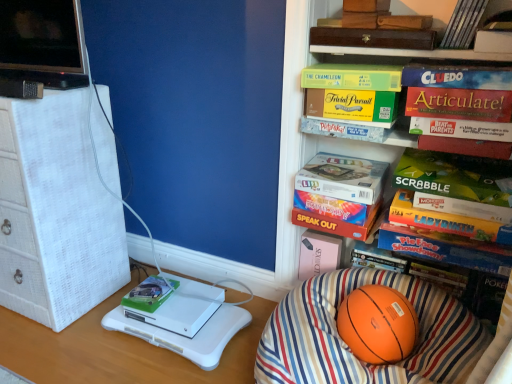
Question: Do you think hardcover book at upper right, the fourth book from the left, is within matte cardboard pictionary at upper center, which is counted as the second book, starting from the top, or outside of it?

Choices:
 (A) outside
 (B) inside

Answer: (A)

Question: Considering the positions of hardcover book at upper right, which is the fourth book from bottom to top, and matte cardboard pictionary at upper center, which is the third book in bottom-to-top order, in the image, is hardcover book at upper right, which is the fourth book from bottom to top, bigger or smaller than matte cardboard pictionary at upper center, which is the third book in bottom-to-top order,?

Choices:
 (A) big
 (B) small

Answer: (A)

Question: Which object is positioned farthest from the white matte xbox at lower left?

Choices:
 (A) hardcover book at center, which is the first paperback book from bottom to top
 (B) orange matte basketball at lower right
 (C) red matte paperback book at upper right, which is the seventh paperback book from top to bottom
 (D) hardcover book at upper right, which is counted as the seventh paperback book, starting from the bottom
 (E) orange rubber basketball at lower center

Answer: (D)

Question: Which object is the closest to the green matte scrabble board game at center-right, the fifth paperback book from the bottom?

Choices:
 (A) white wicker drawer at left
 (B) orange matte basketball at lower right
 (C) red matte paperback book at upper right, which is the seventh paperback book from top to bottom
 (D) hardcover book at upper right, which is counted as the seventh paperback book, starting from the bottom
 (E) multicolored cardboard game at right, which is the 2th paperback book in bottom-to-top order

Answer: (C)